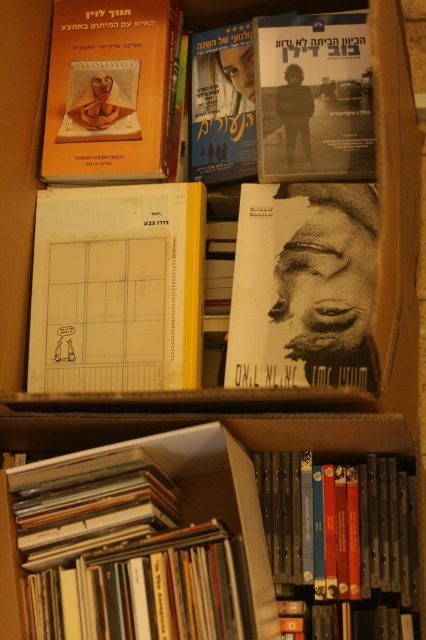
You are organizing books on a shelf and need to decide their order based on thickness. You have the black paper book at center and the matte paper book at upper left. Which one should you place first if you want to arrange them from thinnest to thickest?

The black paper book at center is thinner than the matte paper book at upper left, so you should place the black paper book at center first to arrange them from thinnest to thickest.

You are organizing a library and need to place the matte paper book at upper left and the black matte book at upper center onto a shelf. Which book should you place first if you want to arrange them from left to right in the same order as they appear in the box?

You should place the matte paper book at upper left first because it is positioned to the left of the black matte book at upper center in the box, so arranging them left to right would start with the matte paper book at upper left.

You are looking at the boxes from the front. Which of the two points, point (x=20, y=516) or point (x=80, y=81), is nearer to you?

Point (x=20, y=516) is closer to the viewer than point (x=80, y=81).